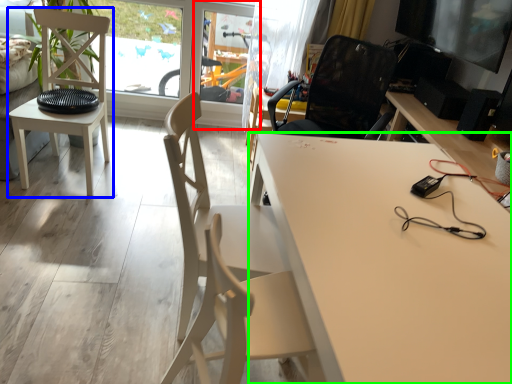
Question: Which is nearer to the screen door (highlighted by a red box)? chair (highlighted by a blue box) or desk (highlighted by a green box).

Choices:
 (A) chair
 (B) desk

Answer: (A)